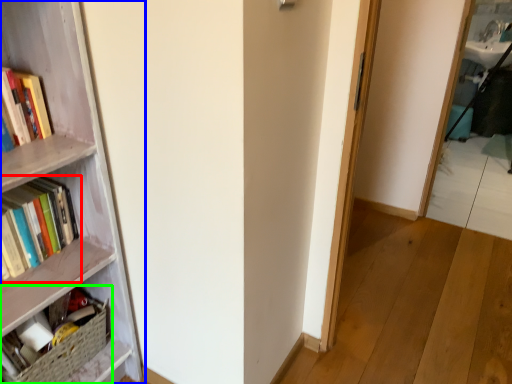
Question: Considering the real-world distances, which object is closest to book (highlighted by a red box)? bookcase (highlighted by a blue box) or book (highlighted by a green box).

Choices:
 (A) bookcase
 (B) book

Answer: (A)